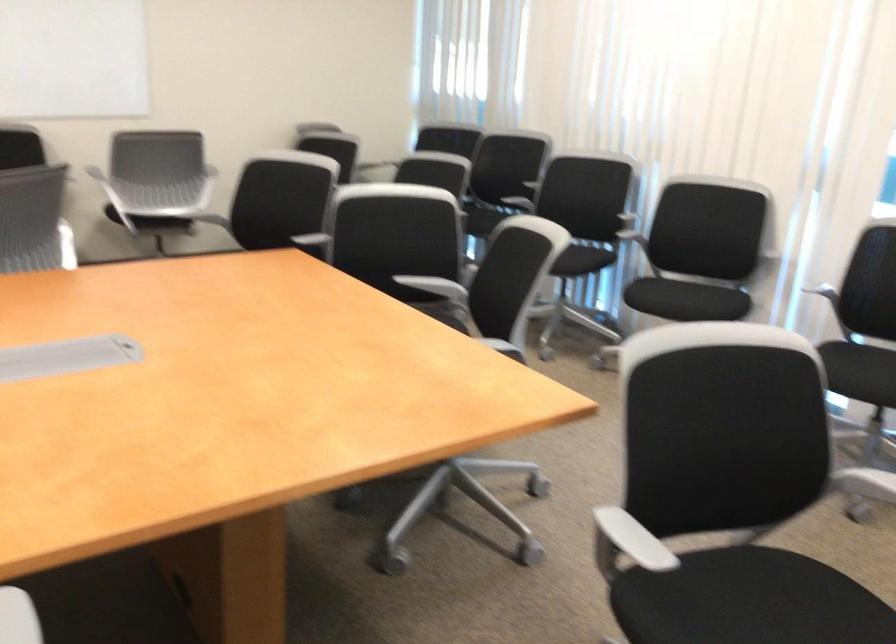
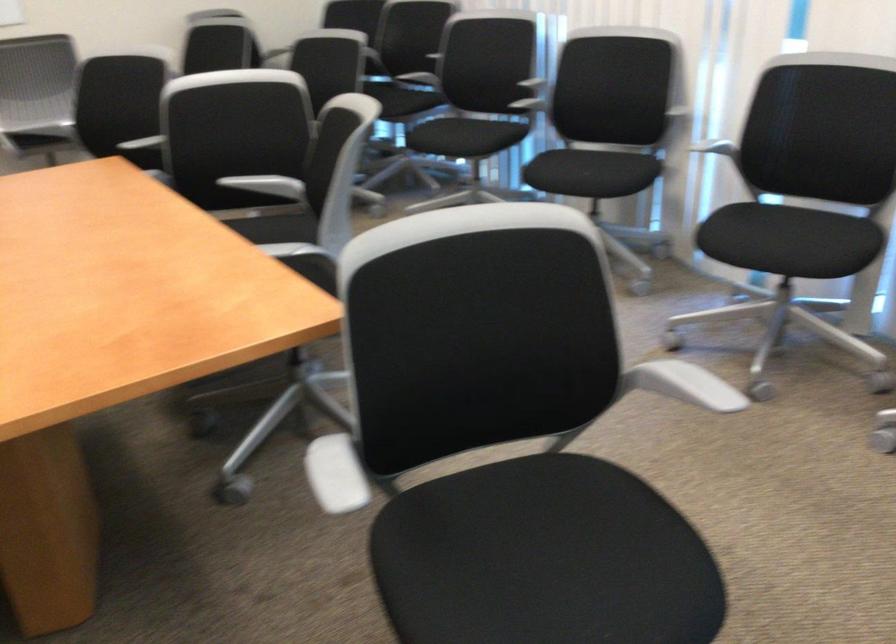
In the second image, find the point that corresponds to the point at 633,544 in the first image.

(334, 474)